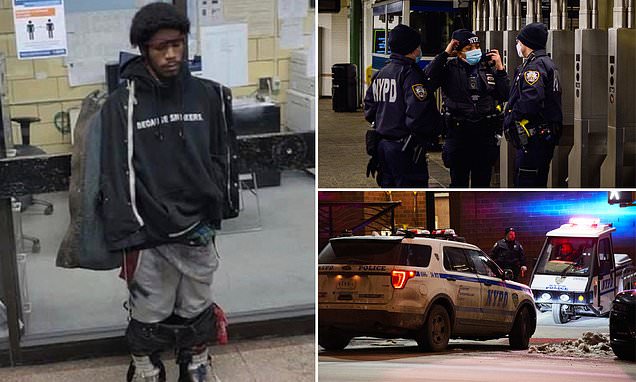
Locate an element on the screen. The width and height of the screenshot is (636, 382). floor is located at coordinates (254, 363), (350, 150).